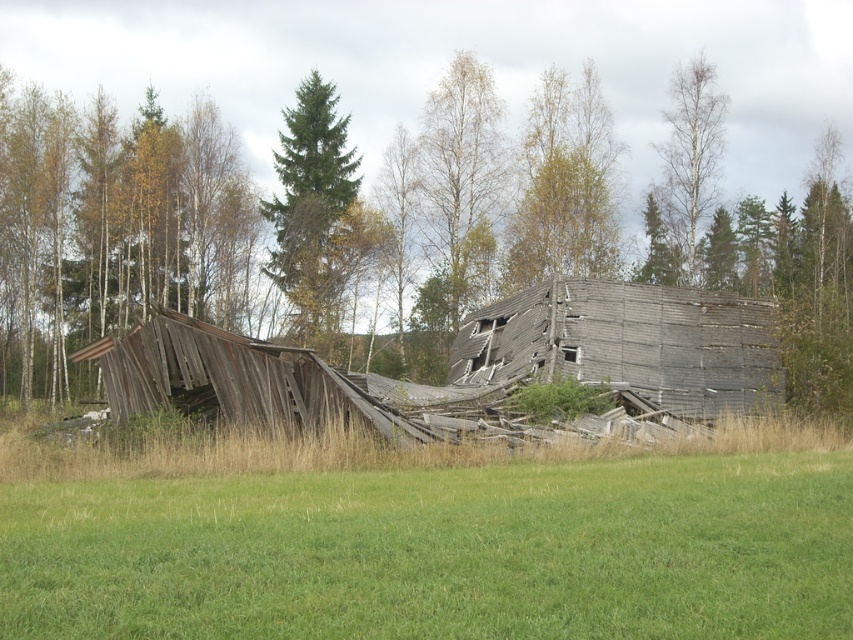
Question: Is the position of weathered wood barn at center less distant than that of weathered wood hut at center?

Choices:
 (A) yes
 (B) no

Answer: (B)

Question: Which point is closer to the camera?

Choices:
 (A) (689, 100)
 (B) (339, 218)
 (C) (167, 381)
 (D) (129, 161)

Answer: (C)

Question: Among these objects, which one is farthest from the camera?

Choices:
 (A) weathered wood hut at center
 (B) weathered wood structure at center
 (C) bare birch tree at upper right
 (D) green coniferous tree at center

Answer: (C)

Question: Which point appears farthest from the camera in this image?

Choices:
 (A) (334, 396)
 (B) (711, 72)
 (C) (593, 195)

Answer: (B)

Question: Is green coniferous tree at center thinner than bare birch tree at upper right?

Choices:
 (A) yes
 (B) no

Answer: (B)

Question: Does weathered wood barn at center appear over green coniferous tree at center?

Choices:
 (A) yes
 (B) no

Answer: (B)